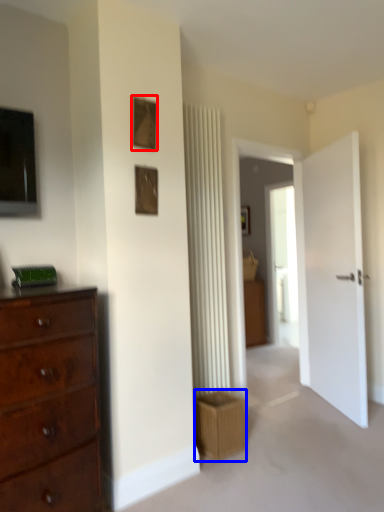
Question: Which object is further to the camera taking this photo, picture frame (highlighted by a red box) or crate (highlighted by a blue box)?

Choices:
 (A) picture frame
 (B) crate

Answer: (B)